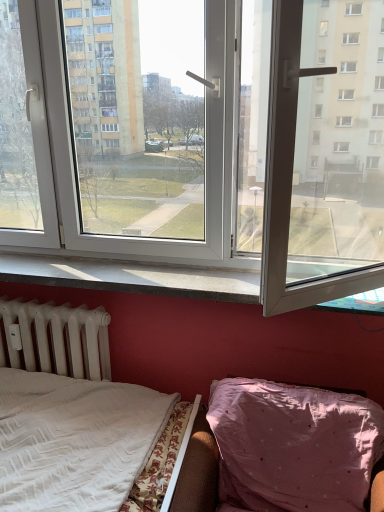
What do you see at coordinates (73, 440) in the screenshot? I see `pink fabric hospital bed at lower right` at bounding box center [73, 440].

Describe the element at coordinates (56, 339) in the screenshot. I see `white matte radiator at lower left` at that location.

In order to face white matte radiator at lower left, should I rotate leftwards or rightwards?

A 19.133 degree turn to the left will do.

The image size is (384, 512). Describe the element at coordinates (70, 414) in the screenshot. I see `white textured bed at lower left` at that location.

Describe the element at coordinates (131, 277) in the screenshot. I see `white glossy window sill at lower center` at that location.

I want to click on white plastic window at center, so click(x=312, y=184).

Where is `radiator to the left of white glossy window sill at lower center`? The image size is (384, 512). radiator to the left of white glossy window sill at lower center is located at coordinates (56, 339).

From a real-world perspective, which object stands above the other?

From a 3D spatial view, white glossy window sill at lower center is above.

Does white glossy window sill at lower center have a greater height compared to white matte radiator at lower left?

Incorrect, the height of white glossy window sill at lower center is not larger of that of white matte radiator at lower left.

From the image's perspective, is white glossy window sill at lower center beneath white matte radiator at lower left?

No.

From the image's perspective, is pink fabric hospital bed at lower right located above white plastic window at center?

Actually, pink fabric hospital bed at lower right appears below white plastic window at center in the image.

The image size is (384, 512). Find the location of `window above the pink fabric hospital bed at lower right (from the image's perspective)`. window above the pink fabric hospital bed at lower right (from the image's perspective) is located at coordinates (312, 184).

Considering the sizes of objects pink fabric hospital bed at lower right and white plastic window at center in the image provided, who is thinner, pink fabric hospital bed at lower right or white plastic window at center?

white plastic window at center is thinner.

Does pink fabric hospital bed at lower right appear on the right side of white plastic window at center?

Yes.

Which is behind, point (60, 325) or point (43, 413)?

The point (60, 325) is behind.

Considering the sizes of objects white matte radiator at lower left and white textured bed at lower left in the image provided, who is shorter, white matte radiator at lower left or white textured bed at lower left?

With less height is white matte radiator at lower left.

Relative to white textured bed at lower left, is white matte radiator at lower left in front or behind?

white matte radiator at lower left is behind white textured bed at lower left.

You are a GUI agent. You are given a task and a screenshot of the screen. Output one action in this format:
    pyautogui.click(x=<x>, y=<y>)
    Task: Click on the bed below the white matte radiator at lower left (from the image's perspective)
    
    Given the screenshot: What is the action you would take?
    pyautogui.click(x=70, y=414)

How many degrees apart are the facing directions of white textured bed at lower left and white matte radiator at lower left?

The angle between the facing direction of white textured bed at lower left and the facing direction of white matte radiator at lower left is 90.4 degrees.

From their relative heights in the image, would you say white textured bed at lower left is taller or shorter than white matte radiator at lower left?

In the image, white textured bed at lower left appears to be taller than white matte radiator at lower left.

From a real-world perspective, which is physically above, white textured bed at lower left or white matte radiator at lower left?

white matte radiator at lower left.

From the picture: Which of these two, white textured bed at lower left or white matte radiator at lower left, is bigger?

white textured bed at lower left.

Which of these two, pink fabric hospital bed at lower right or white glossy window sill at lower center, stands shorter?

white glossy window sill at lower center is shorter.

In the scene shown: Are pink fabric hospital bed at lower right and white glossy window sill at lower center making contact?

No, pink fabric hospital bed at lower right is not making contact with white glossy window sill at lower center.

From the image's perspective, is pink fabric hospital bed at lower right above white glossy window sill at lower center?

Incorrect, from the image's perspective, pink fabric hospital bed at lower right is lower than white glossy window sill at lower center.

In the scene shown: Between pink fabric hospital bed at lower right and white glossy window sill at lower center, which one has larger size?

Bigger between the two is pink fabric hospital bed at lower right.

From the image's perspective, who appears lower, white matte radiator at lower left or white plastic window at center?

white matte radiator at lower left appears lower in the image.

Considering the sizes of objects white matte radiator at lower left and white plastic window at center in the image provided, who is shorter, white matte radiator at lower left or white plastic window at center?

With less height is white matte radiator at lower left.

Which of these two, white matte radiator at lower left or white plastic window at center, is bigger?

Bigger between the two is white plastic window at center.

How different are the orientations of white matte radiator at lower left and white plastic window at center in degrees?

The angular difference between white matte radiator at lower left and white plastic window at center is 0.508 degrees.

Is white textured bed at lower left oriented towards pink fabric hospital bed at lower right?

Yes.

Considering the points (93, 388) and (94, 495), which point is behind, point (93, 388) or point (94, 495)?

The point (93, 388) is behind.

In the image, is white textured bed at lower left on the left side or the right side of pink fabric hospital bed at lower right?

Clearly, white textured bed at lower left is on the left of pink fabric hospital bed at lower right in the image.

Which object is further away from the camera, white textured bed at lower left or pink fabric hospital bed at lower right?

white textured bed at lower left is behind.

Where is `radiator on the left of white glossy window sill at lower center`? radiator on the left of white glossy window sill at lower center is located at coordinates (56, 339).

Identify the location of hospital bed that is on the right side of white plastic window at center. (73, 440).

Estimate the real-world distances between objects in this image. Which object is further from white plastic window at center, white matte radiator at lower left or white textured bed at lower left?

white textured bed at lower left is further to white plastic window at center.

Estimate the real-world distances between objects in this image. Which object is further from white glossy window sill at lower center, pink fabric hospital bed at lower right or white textured bed at lower left?

pink fabric hospital bed at lower right lies further to white glossy window sill at lower center than the other object.

From the image, which object appears to be nearer to white glossy window sill at lower center, white textured bed at lower left or pink fabric hospital bed at lower right?

white textured bed at lower left lies closer to white glossy window sill at lower center than the other object.

Based on their spatial positions, is white glossy window sill at lower center or white textured bed at lower left closer to white plastic window at center?

white glossy window sill at lower center lies closer to white plastic window at center than the other object.

Which object lies further to the anchor point pink fabric hospital bed at lower right, white textured bed at lower left or white plastic window at center?

white plastic window at center.

From the image, which object appears to be nearer to white glossy window sill at lower center, white textured bed at lower left or white plastic window at center?

white textured bed at lower left is positioned closer to the anchor white glossy window sill at lower center.

Looking at this image, from the image, which object appears to be farther from white glossy window sill at lower center, pink fabric hospital bed at lower right or white plastic window at center?

white plastic window at center is further to white glossy window sill at lower center.

From the image, which object appears to be nearer to white glossy window sill at lower center, white matte radiator at lower left or pink fabric hospital bed at lower right?

The object closer to white glossy window sill at lower center is white matte radiator at lower left.

Image resolution: width=384 pixels, height=512 pixels. Find the location of `window sill between white plastic window at center and pink fabric hospital bed at lower right in the up-down direction`. window sill between white plastic window at center and pink fabric hospital bed at lower right in the up-down direction is located at coordinates (131, 277).

The height and width of the screenshot is (512, 384). In order to click on window sill positioned between white plastic window at center and white matte radiator at lower left from near to far in this screenshot , I will do `click(131, 277)`.

You are a GUI agent. You are given a task and a screenshot of the screen. Output one action in this format:
    pyautogui.click(x=<x>, y=<y>)
    Task: Click on the bed between white matte radiator at lower left and pink fabric hospital bed at lower right in the horizontal direction
    This screenshot has height=512, width=384.
    Given the screenshot: What is the action you would take?
    pyautogui.click(x=70, y=414)

Find the location of `window sill between white plastic window at center and white textured bed at lower left vertically`. window sill between white plastic window at center and white textured bed at lower left vertically is located at coordinates (131, 277).